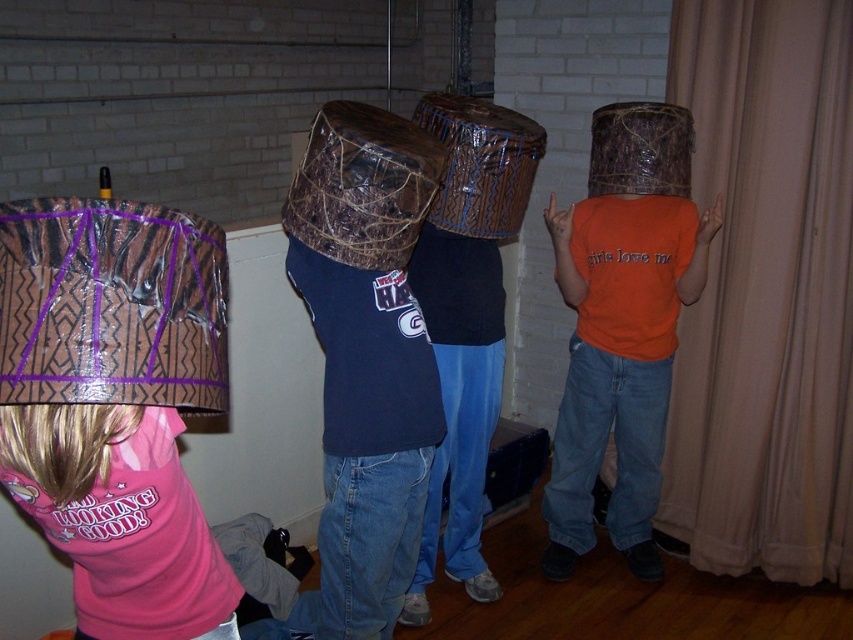
Question: Which of the following is the farthest from the observer?

Choices:
 (A) (32, 227)
 (B) (486, 193)

Answer: (B)

Question: Where is orange matte t-shirt at center located in relation to brown woven basket at center in the image?

Choices:
 (A) left
 (B) right

Answer: (B)

Question: Can you confirm if matte brown drum at left is positioned above brown textured basket at center?

Choices:
 (A) no
 (B) yes

Answer: (A)

Question: Among these points, which one is farthest from the camera?

Choices:
 (A) (674, 352)
 (B) (515, 131)

Answer: (A)

Question: In this image, where is beige fabric curtain at right located relative to orange matte t-shirt at center?

Choices:
 (A) above
 (B) below

Answer: (A)

Question: Which point appears closest to the camera in this image?

Choices:
 (A) (503, 138)
 (B) (386, 189)

Answer: (B)